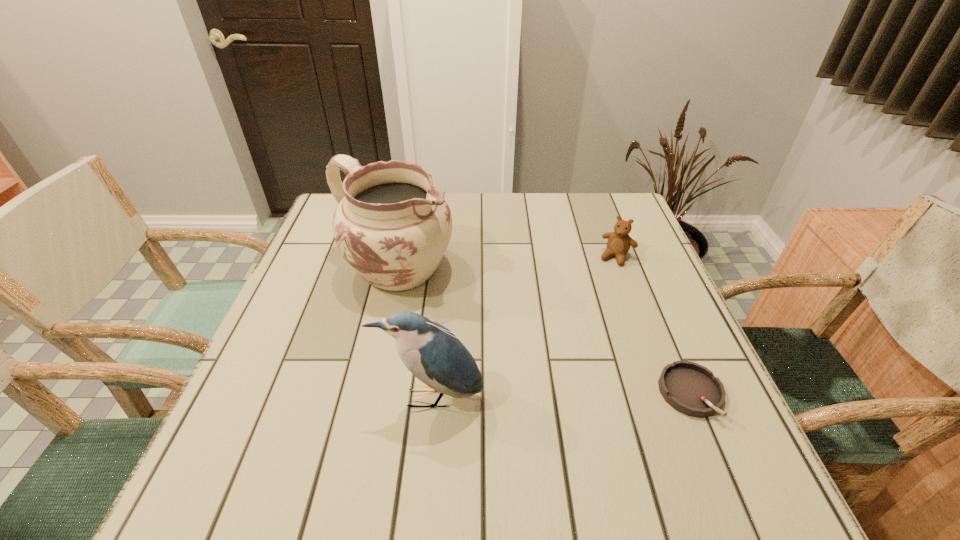
Locate an element on the screen. The height and width of the screenshot is (540, 960). free space between the bird and the ashtray is located at coordinates pos(561,396).

Where is `vacant space that is in between the pitcher and the ashtray`? vacant space that is in between the pitcher and the ashtray is located at coordinates (543, 332).

Identify the location of vacant space in between the tallest object and the third tallest object. This screenshot has height=540, width=960. [506, 263].

Image resolution: width=960 pixels, height=540 pixels. What are the coordinates of `vacant area that lies between the teddy bear and the tallest object` in the screenshot? It's located at (506, 263).

The height and width of the screenshot is (540, 960). In order to click on unoccupied area between the pitcher and the third tallest object in this screenshot , I will do `click(506, 263)`.

Identify which object is the second nearest to the shortest object. Please provide its 2D coordinates. Your answer should be formatted as a tuple, i.e. [(x, y)], where the tuple contains the x and y coordinates of a point satisfying the conditions above.

[(432, 353)]

Find the location of `object that can be found as the third closest to the tallest object`. object that can be found as the third closest to the tallest object is located at coordinates (690, 388).

Identify the location of free spot that satisfies the following two spatial constraints: 1. on the front side of the pitcher; 2. on the right side of the shortest object. This screenshot has height=540, width=960. (367, 394).